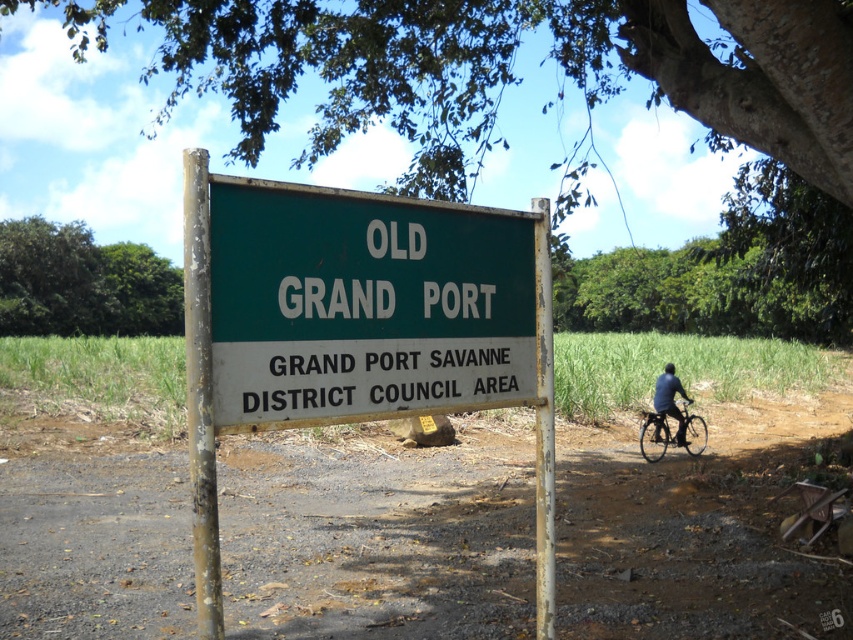
Consider the image. Does brown dirt field at center appear on the right side of green leafy tree at upper left?

Correct, you'll find brown dirt field at center to the right of green leafy tree at upper left.

Looking at this image, how distant is brown dirt field at center from green leafy tree at upper left?

The distance of brown dirt field at center from green leafy tree at upper left is 43.23 meters.

Consider the image. Who is more forward, (83, 493) or (146, 260)?

Point (83, 493)

This screenshot has width=853, height=640. I want to click on brown dirt field at center, so click(378, 534).

Is point (753, 147) more distant than point (663, 444)?

No, it is in front of (663, 444).

Does point (368, 83) lie in front of point (660, 424)?

Yes, point (368, 83) is in front of point (660, 424).

Locate an element on the screen. green leafy tree at upper center is located at coordinates (566, 77).

Does brown dirt field at center appear under dark blue fabric at right?

Indeed, brown dirt field at center is positioned under dark blue fabric at right.

Who is higher up, brown dirt field at center or dark blue fabric at right?

dark blue fabric at right

Between point (76, 588) and point (656, 412), which one is positioned in front?

Point (76, 588) is more forward.

Where is `brown dirt field at center`? brown dirt field at center is located at coordinates (378, 534).